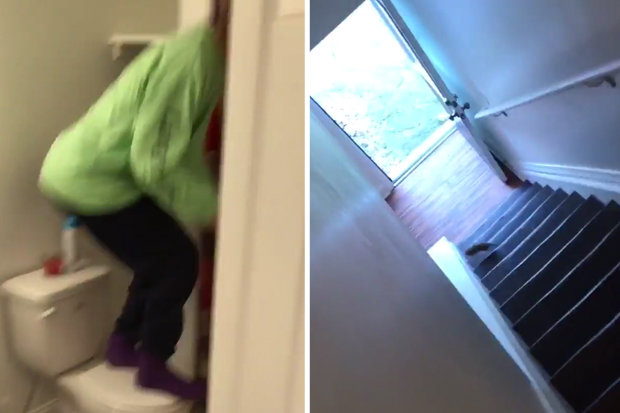
Find the location of a particular element. Image resolution: width=620 pixels, height=413 pixels. shelf is located at coordinates (131, 38).